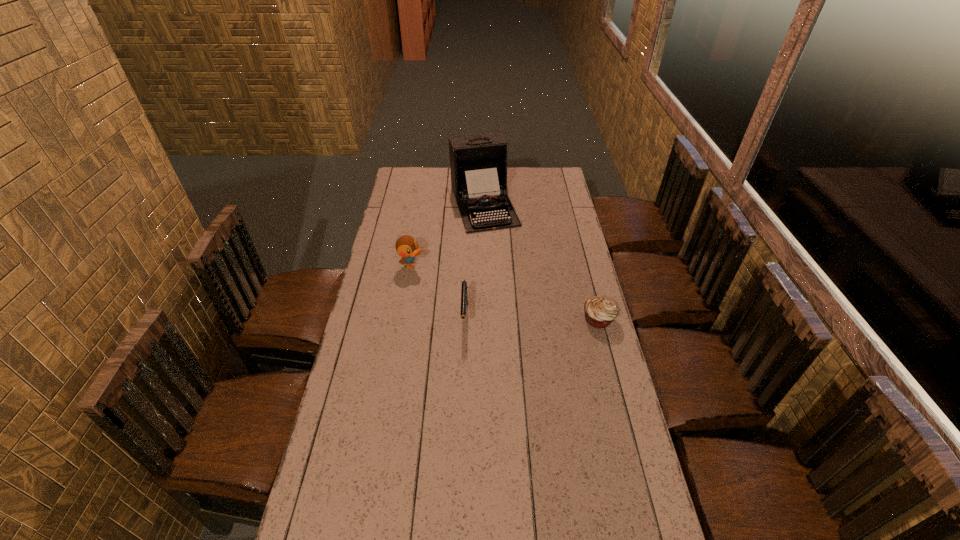
Where is `vacant space situated 0.200m on the front-facing side of the leftmost object`? The width and height of the screenshot is (960, 540). vacant space situated 0.200m on the front-facing side of the leftmost object is located at coordinates (459, 289).

Where is `free location located 0.170m on the front-facing side of the leftmost object`? The image size is (960, 540). free location located 0.170m on the front-facing side of the leftmost object is located at coordinates (453, 286).

The width and height of the screenshot is (960, 540). I want to click on vacant space located inside the open case of the typewriter, so click(x=513, y=282).

Identify the location of free location located inside the open case of the typewriter. The image size is (960, 540). (507, 268).

Locate an element on the screen. blank area located inside the open case of the typewriter is located at coordinates (501, 254).

Locate an element on the screen. object positioned at the far edge is located at coordinates (478, 163).

At what (x,y) coordinates should I click in order to perform the action: click on object at the left edge. Please return your answer as a coordinate pair (x, y). Image resolution: width=960 pixels, height=540 pixels. Looking at the image, I should click on (406, 246).

At what (x,y) coordinates should I click in order to perform the action: click on object located in the right edge section of the desktop. Please return your answer as a coordinate pair (x, y). Looking at the image, I should click on (600, 311).

In the image, there is a desktop. Where is `free space at the far edge`? free space at the far edge is located at coordinates (439, 168).

Image resolution: width=960 pixels, height=540 pixels. I want to click on vacant space at the near edge of the desktop, so click(392, 515).